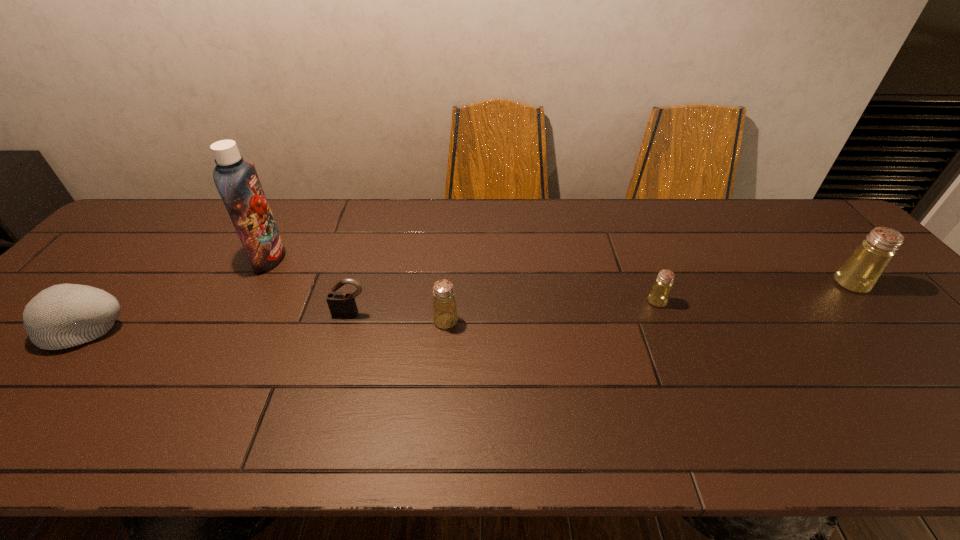
Where is `free space located on the left of the second tallest saltshaker`? free space located on the left of the second tallest saltshaker is located at coordinates (389, 321).

In order to click on free space located 0.110m on the back of the shortest object in this screenshot , I will do `click(643, 267)`.

Find the location of a particular element. free location located on the front of the tallest saltshaker is located at coordinates (913, 354).

The height and width of the screenshot is (540, 960). What are the coordinates of `blank space located 0.200m on the right of the beanie` in the screenshot? It's located at (212, 327).

In order to click on vacant space located 0.190m with the keyhole on the front of the fourth object from right to left in this screenshot , I will do `click(330, 382)`.

Find the location of a particular element. The width and height of the screenshot is (960, 540). vacant space situated on the front label of the fifth object from right to left is located at coordinates (385, 258).

Where is `object located in the far edge section of the desktop`? object located in the far edge section of the desktop is located at coordinates (237, 182).

What are the coordinates of `object present at the left edge` in the screenshot? It's located at (65, 315).

The height and width of the screenshot is (540, 960). Identify the location of object at the right edge. (860, 272).

In the image, there is a desktop. Where is `vacant area at the far edge`? This screenshot has width=960, height=540. vacant area at the far edge is located at coordinates (669, 244).